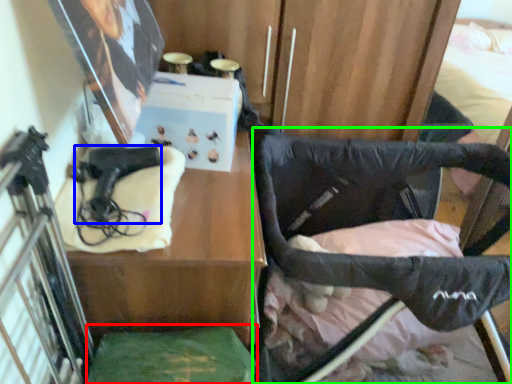
Question: Based on their relative distances, which object is nearer to wide (highlighted by a red box)? Choose from handgun (highlighted by a blue box) and furniture (highlighted by a green box).

Choices:
 (A) handgun
 (B) furniture

Answer: (A)